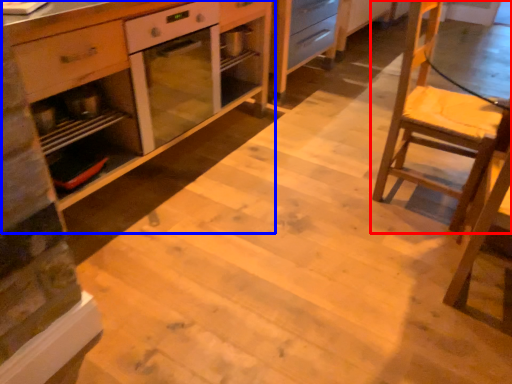
Question: Which of the following is the farthest to the observer, chair (highlighted by a red box) or cabinetry (highlighted by a blue box)?

Choices:
 (A) chair
 (B) cabinetry

Answer: (A)